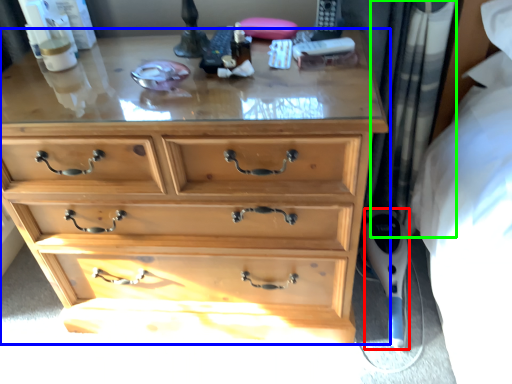
Question: Which object is the closest to the equipment (highlighted by a red box)? Choose among these: chest of drawers (highlighted by a blue box) or curtain (highlighted by a green box).

Choices:
 (A) chest of drawers
 (B) curtain

Answer: (B)